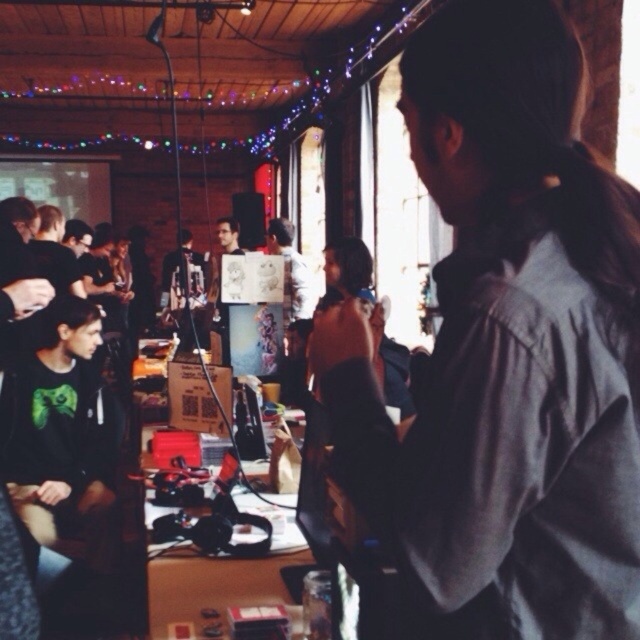
Who is more distant from viewer, (433, 97) or (100, 448)?

The point (100, 448) is behind.

Between point (612, 435) and point (29, 500), which one is positioned behind?

The point (29, 500) is behind.

Locate an element on the screen. gray shirt at upper right is located at coordinates (506, 348).

Identify the location of gray shirt at upper right. (506, 348).

Is point (524, 497) closer to camera compared to point (60, 241)?

Yes, point (524, 497) is in front of point (60, 241).

The image size is (640, 640). Find the location of `gray shirt at upper right`. gray shirt at upper right is located at coordinates (506, 348).

Can you confirm if black matte shirt at lower left is wider than matte black shirt at left?

Correct, the width of black matte shirt at lower left exceeds that of matte black shirt at left.

Find the location of a particular element. The width and height of the screenshot is (640, 640). black matte shirt at lower left is located at coordinates (60, 426).

Is point (88, 332) farther from viewer compared to point (52, 240)?

No, it is in front of (52, 240).

Identify the location of black matte shirt at lower left. The image size is (640, 640). (60, 426).